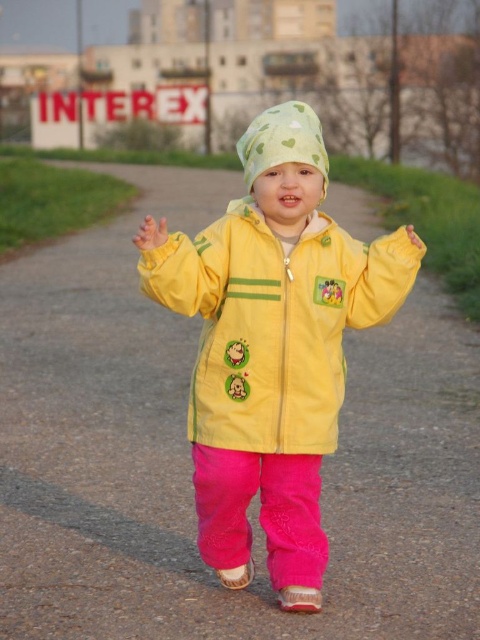
You are a drone operator trying to capture a photo of the child in the image. You need to position your drone so that it flies directly between the two points, point (324, 394) and point (317, 154). Which point should the drone fly closer to in order to stay behind the child?

The drone should fly closer to point (324, 394) because it is behind point (317, 154), so positioning the drone near this point would keep it behind the child.

Please describe the exact location of the yellow matte jacket at center in the image using the coordinate system where the bottom left corner is the origin point. The coordinates are given as a pair of numbers between 0 and 1, representing the horizontal and vertical positions respectively.

The yellow matte jacket at center is located at the coordinate point of (275, 323).